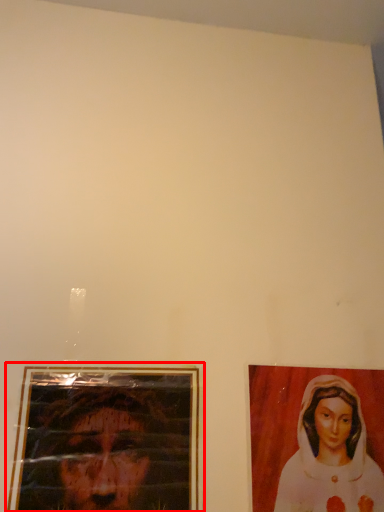
Question: In this image, where is picture frame (annotated by the red box) located relative to woman?

Choices:
 (A) right
 (B) left

Answer: (B)